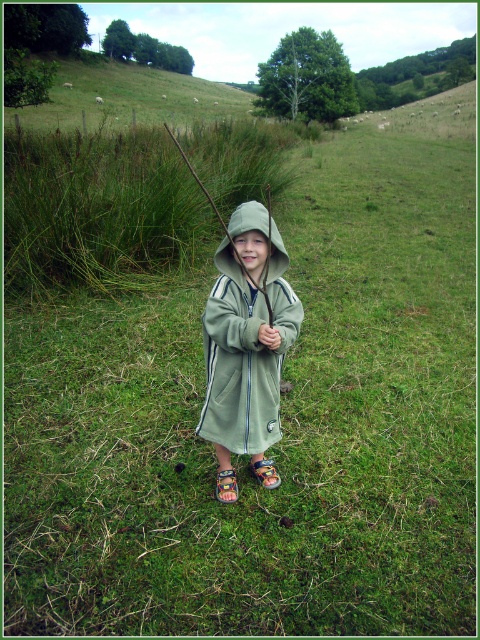
You are a photographer trying to capture the child in the scene. Since both the green fleece jacket at center and the green wood stick at center are in the center, which one should you focus on to ensure the other is still in the background?

You should focus on the green fleece jacket at center because it is in front of the green wood stick at center, ensuring the stick remains in the background.

You are a fashion designer observing the child in the image. You need to determine if the green fleece jacket at center can be worn over the green wood stick at center. Based on their sizes, what do you think?

The green fleece jacket at center is smaller than the green wood stick at center, so it cannot be worn over the stick as the jacket is not large enough to accommodate the stick.

You are a drone operator trying to deliver a small package to a child wearing a green fleece jacket at center. The drone can only hover at a minimum height of 1 meter above the ground. Considering the distance between you and the jacket, can the drone safely land the package without getting too close?

The green fleece jacket at center and viewer are 2.31 meters apart. Since the drone can hover at 1 meter above the ground, it can safely land the package at the green fleece jacket at center from a distance of 2.31 meters without needing to get closer.